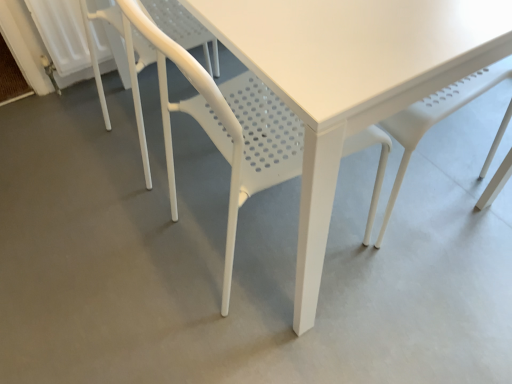
Describe the element at coordinates (129, 67) in the screenshot. I see `white plastic chair at lower left, acting as the first chair starting from the left` at that location.

Identify the location of white plastic chair at lower left, acting as the first chair starting from the left. (129, 67).

What is the approximate width of white plastic chair at center, the second chair in the left-to-right sequence?

The width of white plastic chair at center, the second chair in the left-to-right sequence, is 19.73 inches.

What do you see at coordinates (222, 120) in the screenshot? I see `white plastic chair at center, the 1th chair positioned from the right` at bounding box center [222, 120].

This screenshot has width=512, height=384. What are the coordinates of `white plastic chair at center, the second chair in the left-to-right sequence` in the screenshot? It's located at (222, 120).

Where is `white plastic chair at lower left, which is the 2th chair in right-to-left order`? The width and height of the screenshot is (512, 384). white plastic chair at lower left, which is the 2th chair in right-to-left order is located at coordinates (129, 67).

Is white plastic chair at center, the 1th chair positioned from the right, at the left side of white plastic chair at lower left, acting as the first chair starting from the left?

No, white plastic chair at center, the 1th chair positioned from the right, is not to the left of white plastic chair at lower left, acting as the first chair starting from the left.

Is white plastic chair at center, the 1th chair positioned from the right, closer to camera compared to white plastic chair at lower left, acting as the first chair starting from the left?

Yes.

Considering the positions of point (208, 114) and point (132, 66), is point (208, 114) closer or farther from the camera than point (132, 66)?

Point (208, 114) appears to be closer to the viewer than point (132, 66).

From the image's perspective, is white plastic chair at center, the second chair in the left-to-right sequence, located above or below white plastic chair at lower left, which is the 2th chair in right-to-left order?

From the image's perspective, white plastic chair at center, the second chair in the left-to-right sequence, appears below white plastic chair at lower left, which is the 2th chair in right-to-left order.

From the picture: From a real-world perspective, between white plastic chair at center, the 1th chair positioned from the right, and white plastic chair at lower left, acting as the first chair starting from the left, who is vertically lower?

white plastic chair at lower left, acting as the first chair starting from the left.

In the scene shown: Which of these two, white plastic chair at center, the second chair in the left-to-right sequence, or white plastic chair at lower left, acting as the first chair starting from the left, is wider?

With larger width is white plastic chair at lower left, acting as the first chair starting from the left.

Is white plastic chair at center, the second chair in the left-to-right sequence, shorter than white plastic chair at lower left, acting as the first chair starting from the left?

No, white plastic chair at center, the second chair in the left-to-right sequence, is not shorter than white plastic chair at lower left, acting as the first chair starting from the left.

Which of these two, white plastic chair at center, the second chair in the left-to-right sequence, or white plastic chair at lower left, acting as the first chair starting from the left, is smaller?

With smaller size is white plastic chair at lower left, acting as the first chair starting from the left.

Is white plastic chair at center, the 1th chair positioned from the right, positioned beyond the bounds of white plastic chair at lower left, which is the 2th chair in right-to-left order?

Yes, white plastic chair at center, the 1th chair positioned from the right, is not within white plastic chair at lower left, which is the 2th chair in right-to-left order.

Is white plastic chair at center, the second chair in the left-to-right sequence, in contact with white plastic chair at lower left, which is the 2th chair in right-to-left order?

They are not placed beside each other.

Is white plastic chair at lower left, acting as the first chair starting from the left, at the back of white plastic chair at center, the second chair in the left-to-right sequence?

That's not correct — white plastic chair at center, the second chair in the left-to-right sequence, is not looking away from white plastic chair at lower left, acting as the first chair starting from the left.

How different are the orientations of white plastic chair at center, the 1th chair positioned from the right, and white plastic chair at lower left, which is the 2th chair in right-to-left order, in degrees?

There is a 0.000322-degree angle between the facing directions of white plastic chair at center, the 1th chair positioned from the right, and white plastic chair at lower left, which is the 2th chair in right-to-left order.

How much distance is there between white plastic chair at center, the second chair in the left-to-right sequence, and white plastic chair at lower left, which is the 2th chair in right-to-left order?

They are 7.58 inches apart.

The width and height of the screenshot is (512, 384). What are the coordinates of `chair on the left side of white plastic chair at center, the 1th chair positioned from the right` in the screenshot? It's located at (129, 67).

Considering the relative positions of white plastic chair at lower left, which is the 2th chair in right-to-left order, and white plastic chair at center, the second chair in the left-to-right sequence, in the image provided, is white plastic chair at lower left, which is the 2th chair in right-to-left order, to the left or to the right of white plastic chair at center, the second chair in the left-to-right sequence,?

In the image, white plastic chair at lower left, which is the 2th chair in right-to-left order, appears on the left side of white plastic chair at center, the second chair in the left-to-right sequence.

In the image, is white plastic chair at lower left, acting as the first chair starting from the left, positioned in front of or behind white plastic chair at center, the 1th chair positioned from the right?

white plastic chair at lower left, acting as the first chair starting from the left, is positioned farther from the viewer than white plastic chair at center, the 1th chair positioned from the right.

Considering the positions of point (143, 141) and point (178, 45), is point (143, 141) closer or farther from the camera than point (178, 45)?

Point (143, 141) is positioned closer to the camera compared to point (178, 45).

From the image's perspective, is white plastic chair at lower left, acting as the first chair starting from the left, positioned above or below white plastic chair at center, the 1th chair positioned from the right?

Clearly, from the image's perspective, white plastic chair at lower left, acting as the first chair starting from the left, is above white plastic chair at center, the 1th chair positioned from the right.

From a real-world perspective, between white plastic chair at lower left, acting as the first chair starting from the left, and white plastic chair at center, the 1th chair positioned from the right, who is vertically lower?

In real-world perspective, white plastic chair at lower left, acting as the first chair starting from the left, is lower.

Can you confirm if white plastic chair at lower left, which is the 2th chair in right-to-left order, is thinner than white plastic chair at center, the 1th chair positioned from the right?

Incorrect, the width of white plastic chair at lower left, which is the 2th chair in right-to-left order, is not less than that of white plastic chair at center, the 1th chair positioned from the right.

Considering the sizes of white plastic chair at lower left, which is the 2th chair in right-to-left order, and white plastic chair at center, the 1th chair positioned from the right, in the image, is white plastic chair at lower left, which is the 2th chair in right-to-left order, taller or shorter than white plastic chair at center, the 1th chair positioned from the right,?

white plastic chair at lower left, which is the 2th chair in right-to-left order, is shorter than white plastic chair at center, the 1th chair positioned from the right.

Considering the sizes of objects white plastic chair at lower left, which is the 2th chair in right-to-left order, and white plastic chair at center, the 1th chair positioned from the right, in the image provided, who is bigger, white plastic chair at lower left, which is the 2th chair in right-to-left order, or white plastic chair at center, the 1th chair positioned from the right,?

Bigger between the two is white plastic chair at center, the 1th chair positioned from the right.

Based on the photo, is white plastic chair at lower left, acting as the first chair starting from the left, not within white plastic chair at center, the 1th chair positioned from the right?

Yes, white plastic chair at lower left, acting as the first chair starting from the left, is outside of white plastic chair at center, the 1th chair positioned from the right.

Is the surface of white plastic chair at lower left, acting as the first chair starting from the left, in direct contact with white plastic chair at center, the 1th chair positioned from the right?

They are not placed beside each other.

Is white plastic chair at lower left, which is the 2th chair in right-to-left order, oriented towards white plastic chair at center, the 1th chair positioned from the right?

No, white plastic chair at lower left, which is the 2th chair in right-to-left order, is not facing towards white plastic chair at center, the 1th chair positioned from the right.

How different are the orientations of white plastic chair at lower left, which is the 2th chair in right-to-left order, and white plastic chair at center, the 1th chair positioned from the right, in degrees?

The facing directions of white plastic chair at lower left, which is the 2th chair in right-to-left order, and white plastic chair at center, the 1th chair positioned from the right, are 0.000322 degrees apart.

Measure the distance between white plastic chair at lower left, which is the 2th chair in right-to-left order, and white plastic chair at center, the second chair in the left-to-right sequence.

white plastic chair at lower left, which is the 2th chair in right-to-left order, and white plastic chair at center, the second chair in the left-to-right sequence, are 7.58 inches apart from each other.

Identify the location of chair above the white plastic chair at lower left, which is the 2th chair in right-to-left order (from a real-world perspective). This screenshot has width=512, height=384. (222, 120).

The height and width of the screenshot is (384, 512). In the image, there is a white plastic chair at center, the 1th chair positioned from the right. In order to click on chair above it (from the image's perspective) in this screenshot , I will do click(129, 67).

This screenshot has height=384, width=512. Find the location of `chair in front of the white plastic chair at lower left, which is the 2th chair in right-to-left order`. chair in front of the white plastic chair at lower left, which is the 2th chair in right-to-left order is located at coordinates (222, 120).